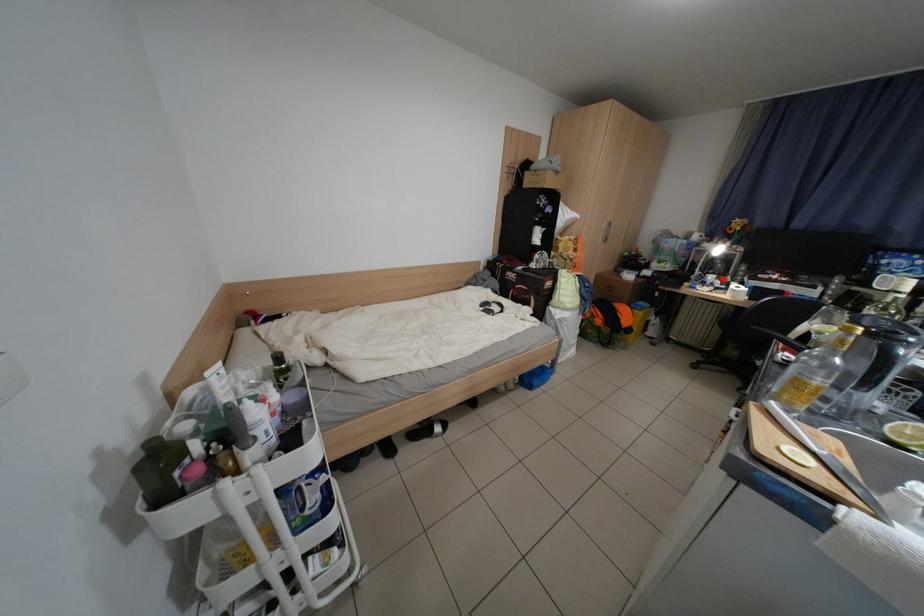
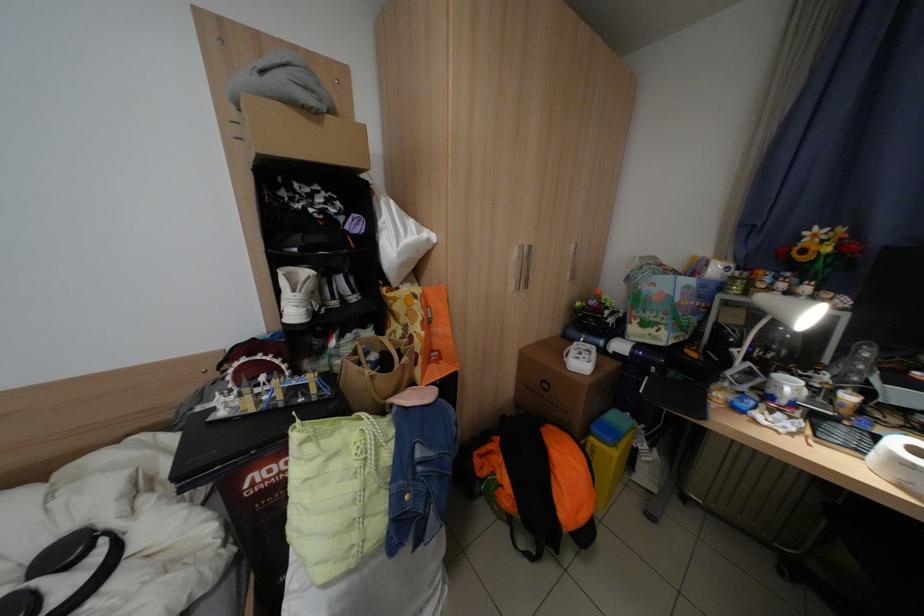
In the second image, find the point that corresponds to the highlighted location in the first image.

(800, 387)